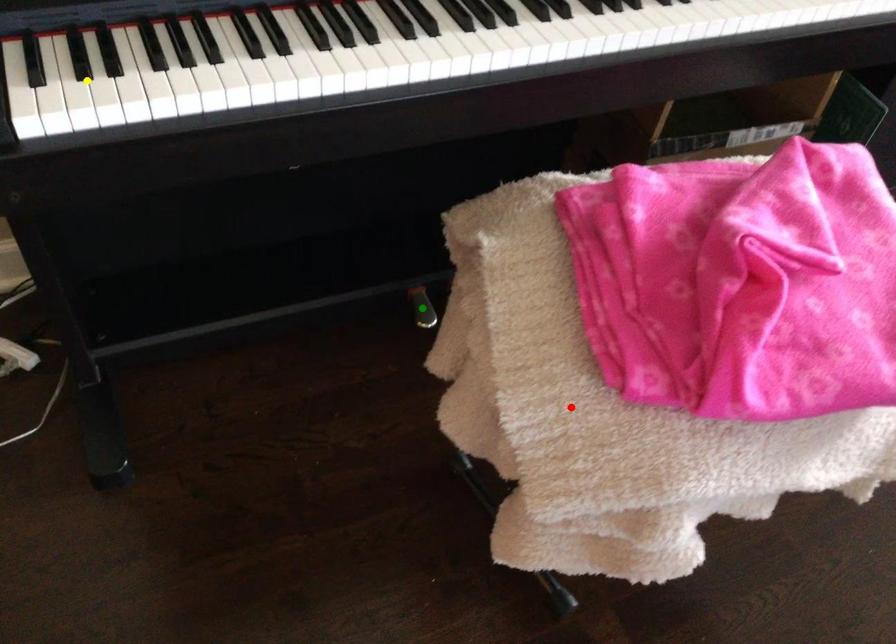
Order these from nearest to farthest:
yellow point, red point, green point

yellow point
red point
green point